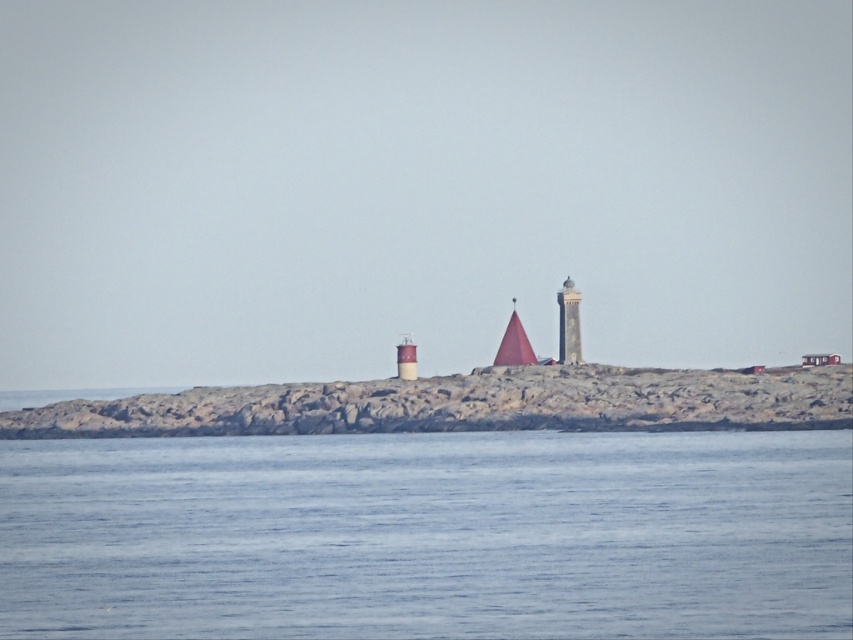
Is rocky island at center to the left of smooth gray tower at center from the viewer's perspective?

Yes, rocky island at center is to the left of smooth gray tower at center.

Between point (44, 419) and point (560, 307), which one is positioned behind?

The point (44, 419) is more distant.

Who is more forward, (498, 378) or (560, 353)?

Point (498, 378) is in front.

The width and height of the screenshot is (853, 640). Find the location of `rocky island at center`. rocky island at center is located at coordinates (467, 404).

Which is in front, point (506, 348) or point (415, 362)?

Point (415, 362)

Is smooth red cone at center thinner than smooth brown tower at center?

Incorrect, smooth red cone at center's width is not less than smooth brown tower at center's.

Which is behind, point (523, 352) or point (415, 346)?

Positioned behind is point (415, 346).

Where is `smooth red cone at center`? The image size is (853, 640). smooth red cone at center is located at coordinates (514, 344).

Which is more to the right, blue water at center or rocky island at center?

Positioned to the right is blue water at center.

From the picture: Measure the distance between blue water at center and camera.

blue water at center and camera are 151.29 meters apart from each other.

Does point (3, 604) come in front of point (697, 403)?

Yes, it is.

Locate an element on the screen. blue water at center is located at coordinates (428, 536).